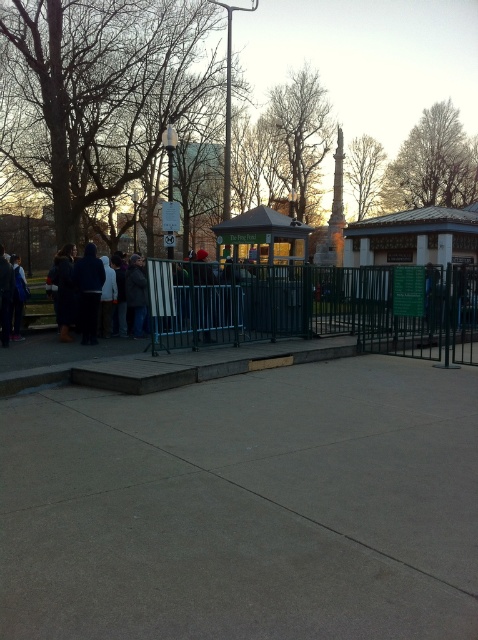
You are standing at the point marked by the coordinates (x=322, y=458) in the image. What object are you standing on?

You are standing on the gray concrete sidewalk at center located at point (x=322, y=458).